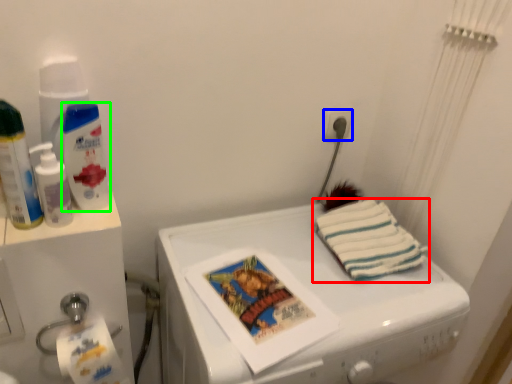
Question: Based on their relative distances, which object is farther from towel/napkin (highlighted by a red box)? Choose from power plugs and sockets (highlighted by a blue box) and cleaning product (highlighted by a green box).

Choices:
 (A) power plugs and sockets
 (B) cleaning product

Answer: (B)